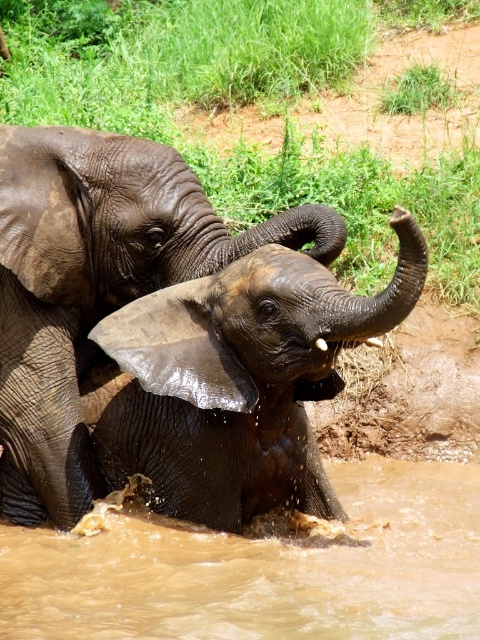
Question: Which of the following is the closest to the observer?

Choices:
 (A) (32, 310)
 (B) (215, 586)

Answer: (B)

Question: Which of the following is the farthest from the observer?

Choices:
 (A) dark gray wet elephant at center
 (B) brown muddy water at lower center

Answer: (A)

Question: Is brown muddy water at lower center closer to the viewer compared to dark gray wet elephant at center?

Choices:
 (A) no
 (B) yes

Answer: (B)

Question: Observing the image, what is the correct spatial positioning of brown muddy water at lower center in reference to dark gray wet elephant at center?

Choices:
 (A) left
 (B) right

Answer: (B)

Question: Can you confirm if brown muddy water at lower center is wider than dark gray wet elephant at center?

Choices:
 (A) no
 (B) yes

Answer: (B)